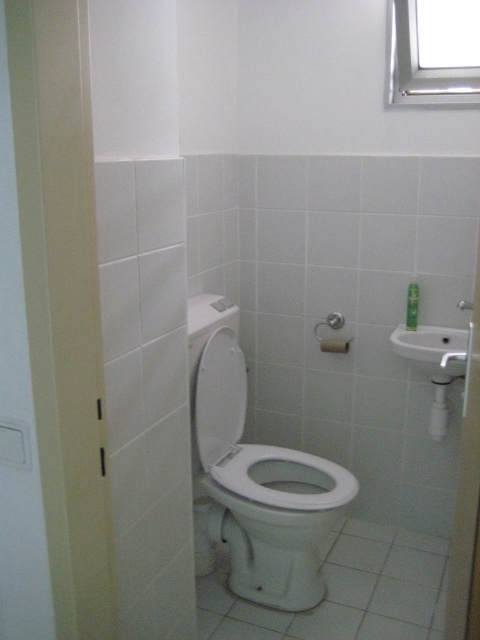
Looking at this image, you are standing in the bathroom and want to reach the point at coordinates point [336,481]. If your arm can extend 1.8 meters, can you reach it?

The point [336,481] is 2.07 meters away from the viewer, which is beyond the arm extension of 1.8 meters, so you cannot reach it.

You are a cleaning robot in the bathroom. You need to reach the white matte toilet paper at center to clean it. Can you move directly to it without moving the matte white shower at center?

The white matte toilet paper at center is in front of the matte white shower at center, so you can move directly to the white matte toilet paper at center without moving the matte white shower at center because it is behind.

You are standing in the bathroom and want to reach a point that is 8.19 feet away from you. Can you confirm if the point at coordinates point (x=323, y=348) is exactly that distance away?

The point (x=323, y=348) is exactly 8.19 feet away from the camera, so yes, the point at coordinates point 0.544, (x=323, y=348) is exactly 8.19 feet away.